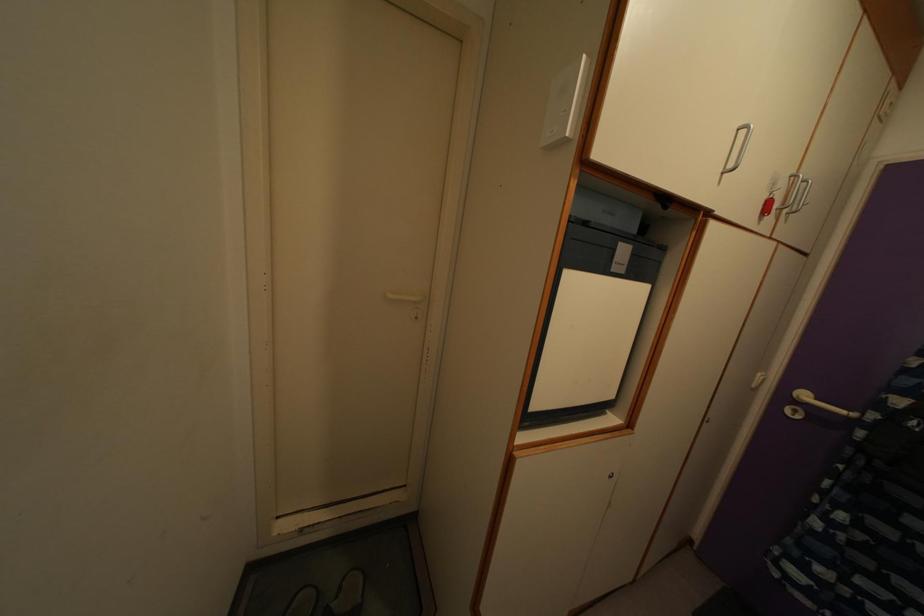
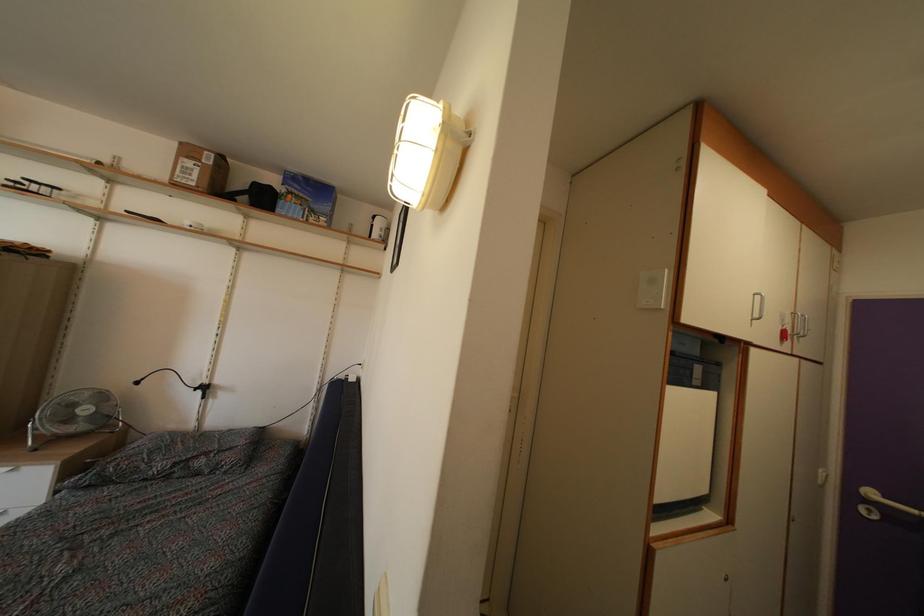
Which direction would the cameraman need to move to produce the second image?

The movement direction of the cameraman is left, backward.